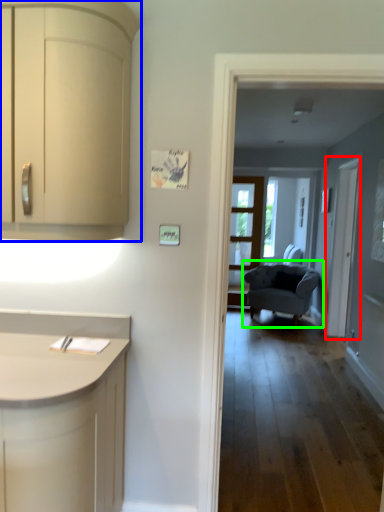
Question: Based on their relative distances, which object is farther from screen door (highlighted by a red box)? Choose from cabinetry (highlighted by a blue box) and chair (highlighted by a green box).

Choices:
 (A) cabinetry
 (B) chair

Answer: (A)